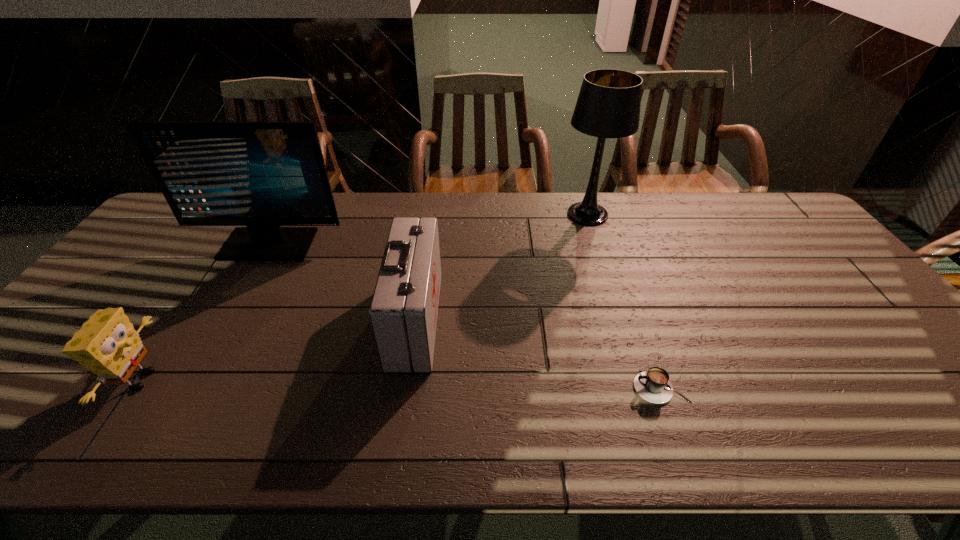
Locate an element on the screen. The height and width of the screenshot is (540, 960). vacant space located with the handle on the side of the cappuccino is located at coordinates (462, 388).

You are a GUI agent. You are given a task and a screenshot of the screen. Output one action in this format:
    pyautogui.click(x=<x>, y=<y>)
    Task: Click on the free space located with the handle on the side of the cappuccino
    
    Given the screenshot: What is the action you would take?
    pyautogui.click(x=462, y=388)

Identify the location of vacant space situated 0.250m with the handle on the side of the cappuccino. The height and width of the screenshot is (540, 960). (523, 388).

At what (x,y) coordinates should I click in order to perform the action: click on table lamp present at the far edge. Please return your answer as a coordinate pair (x, y). Looking at the image, I should click on (608, 106).

Where is `monitor located in the far edge section of the desktop`? The width and height of the screenshot is (960, 540). monitor located in the far edge section of the desktop is located at coordinates (260, 174).

Identify the location of object that is at the near edge. The width and height of the screenshot is (960, 540). (107, 344).

Locate an element on the screen. Image resolution: width=960 pixels, height=540 pixels. vacant space at the far edge of the desktop is located at coordinates (531, 202).

The width and height of the screenshot is (960, 540). Find the location of `vacant space at the near edge of the desktop`. vacant space at the near edge of the desktop is located at coordinates (240, 436).

Where is `free space at the left edge`? free space at the left edge is located at coordinates (56, 401).

Image resolution: width=960 pixels, height=540 pixels. I want to click on vacant position at the right edge of the desktop, so click(799, 281).